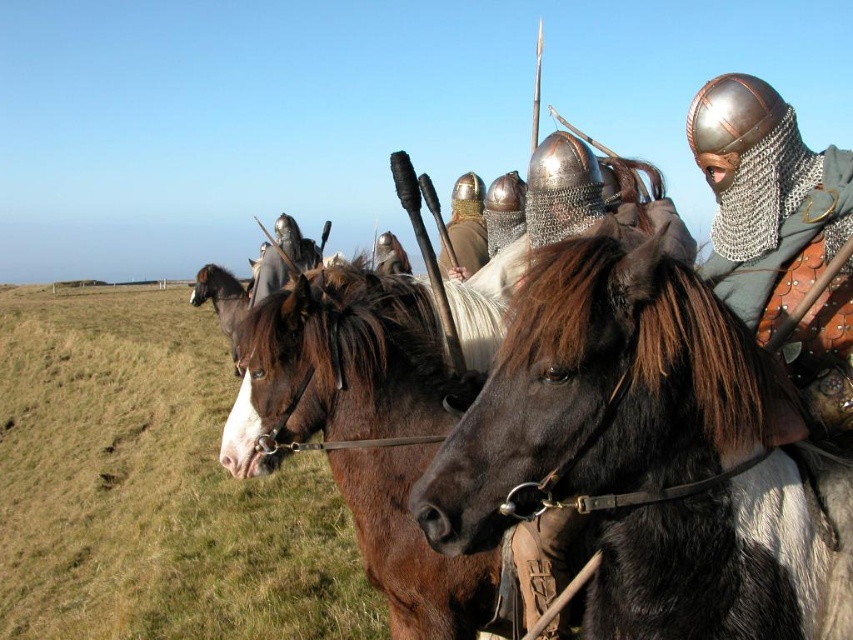
Is metallic helmet at center to the left of brown glossy horse at left from the viewer's perspective?

No, metallic helmet at center is not to the left of brown glossy horse at left.

Does metallic helmet at center lie in front of brown glossy horse at left?

Yes.

Measure the distance between point (x=466, y=209) and camera.

Point (x=466, y=209) and camera are 12.66 feet apart.

What are the coordinates of `metallic helmet at center` in the screenshot? It's located at (465, 227).

Can you confirm if black leather horse at center is thinner than shiny black helmet at center?

Yes.

Between black leather horse at center and shiny black helmet at center, which one appears on the left side from the viewer's perspective?

shiny black helmet at center is more to the left.

Is point (666, 397) positioned after point (256, 273)?

No.

The width and height of the screenshot is (853, 640). Identify the location of black leather horse at center. (650, 456).

Can you confirm if brown leather horse at center is positioned to the left of metallic helmet at center?

Indeed, brown leather horse at center is positioned on the left side of metallic helmet at center.

Does brown leather horse at center have a greater height compared to metallic helmet at center?

Yes.

Where is `brown leather horse at center`? This screenshot has height=640, width=853. brown leather horse at center is located at coordinates (363, 429).